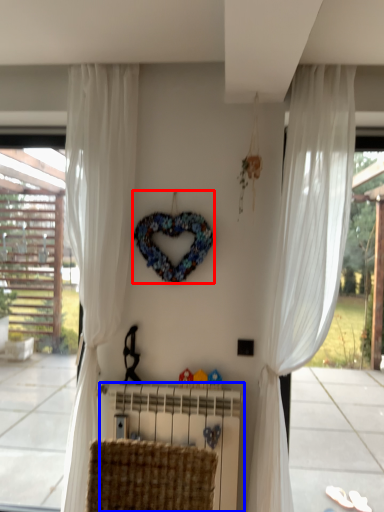
Question: Which point is closer to the camera, wreath (highlighted by a red box) or radiator (highlighted by a blue box)?

Choices:
 (A) wreath
 (B) radiator

Answer: (B)